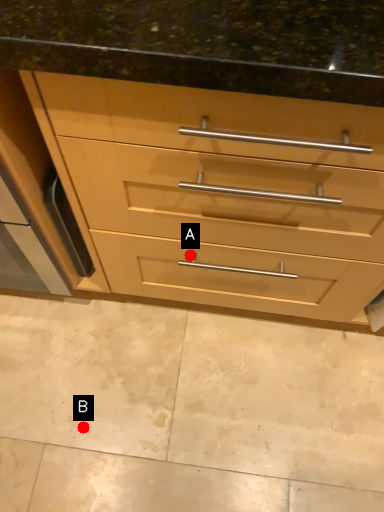
Question: Two points are circled on the image, labeled by A and B beside each circle. Which point is closer to the camera taking this photo?

Choices:
 (A) A is closer
 (B) B is closer

Answer: (A)